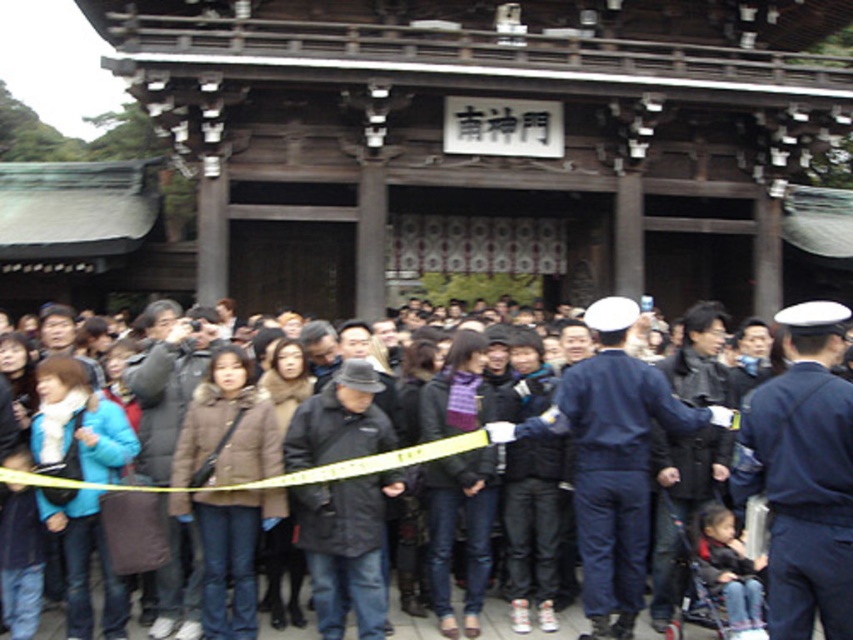
Question: Which of these objects is positioned farthest from the dark gray coat at center?

Choices:
 (A) dark blue uniform at center
 (B) blue uniform at center

Answer: (B)

Question: Which point is farther from the camera taking this photo?

Choices:
 (A) (740, 476)
 (B) (648, 417)

Answer: (B)

Question: Does blue uniform at center lie behind dark gray coat at center?

Choices:
 (A) no
 (B) yes

Answer: (B)

Question: Which object is the farthest from the dark blue uniform at center?

Choices:
 (A) blue uniform at center
 (B) dark gray coat at center

Answer: (A)

Question: Considering the relative positions of dark blue uniform at center and dark gray coat at center in the image provided, where is dark blue uniform at center located with respect to dark gray coat at center?

Choices:
 (A) below
 (B) above

Answer: (B)

Question: Is blue uniform at center bigger than dark gray coat at center?

Choices:
 (A) no
 (B) yes

Answer: (A)